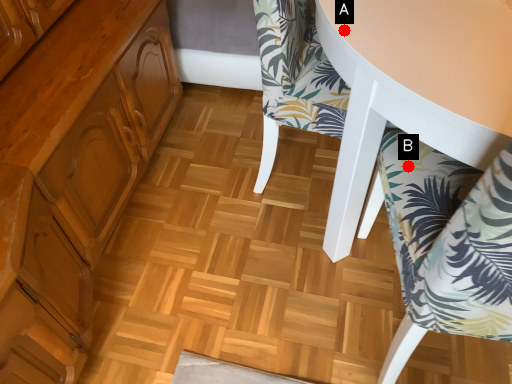
Question: Two points are circled on the image, labeled by A and B beside each circle. Which point is farther from the camera taking this photo?

Choices:
 (A) A is further
 (B) B is further

Answer: (B)